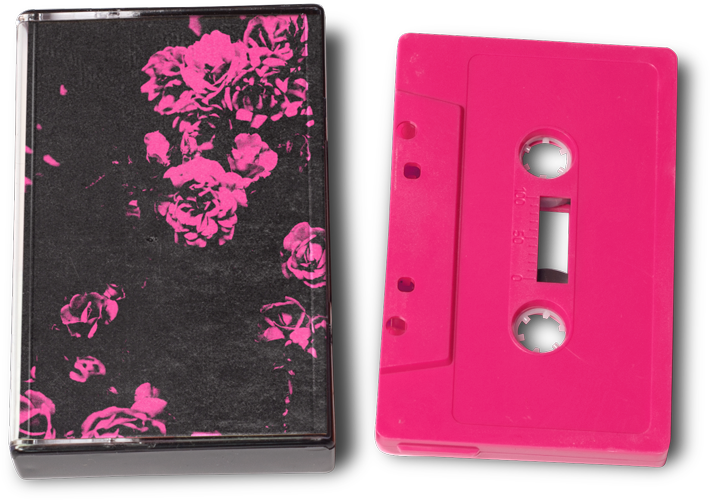
Identify the location of plastic lid. (16, 217).